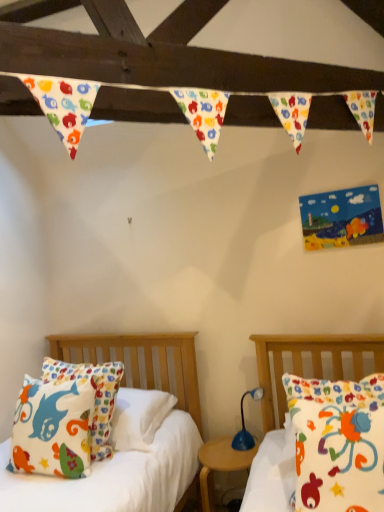
Question: Is matte cotton pillow at left, placed as the 2th bed when sorted from front to back, positioned before blue plastic lamp at center?

Choices:
 (A) yes
 (B) no

Answer: (A)

Question: Is matte cotton pillow at left, which ranks as the 1th bed in left-to-right order, outside of blue plastic lamp at center?

Choices:
 (A) no
 (B) yes

Answer: (B)

Question: From a real-world perspective, is matte cotton pillow at left, acting as the first bed starting from the back, positioned under blue plastic lamp at center based on gravity?

Choices:
 (A) no
 (B) yes

Answer: (A)

Question: Is matte cotton pillow at left, acting as the first bed starting from the back, behind blue plastic lamp at center?

Choices:
 (A) yes
 (B) no

Answer: (B)

Question: Is matte cotton pillow at left, which ranks as the 2th bed in right-to-left order, shorter than blue plastic lamp at center?

Choices:
 (A) yes
 (B) no

Answer: (B)

Question: Considering the relative positions of matte cotton pillow at left, which ranks as the 1th bed in left-to-right order, and matte cotton pillow at right, the first bed in the front-to-back sequence, in the image provided, is matte cotton pillow at left, which ranks as the 1th bed in left-to-right order, to the left or to the right of matte cotton pillow at right, the first bed in the front-to-back sequence,?

Choices:
 (A) left
 (B) right

Answer: (A)

Question: From their relative heights in the image, would you say matte cotton pillow at left, placed as the 2th bed when sorted from front to back, is taller or shorter than matte cotton pillow at right, positioned as the 2th bed in back-to-front order?

Choices:
 (A) tall
 (B) short

Answer: (B)

Question: Based on their sizes in the image, would you say matte cotton pillow at left, which ranks as the 1th bed in left-to-right order, is bigger or smaller than matte cotton pillow at right, arranged as the 2th bed when viewed from the left?

Choices:
 (A) big
 (B) small

Answer: (B)

Question: Do you think matte cotton pillow at left, acting as the first bed starting from the back, is within matte cotton pillow at right, placed as the 1th bed when sorted from right to left, or outside of it?

Choices:
 (A) outside
 (B) inside

Answer: (A)

Question: Does point (61, 432) appear closer or farther from the camera than point (355, 338)?

Choices:
 (A) farther
 (B) closer

Answer: (B)

Question: Considering the positions of matte cotton pillow at left and matte cotton pillow at right, the first bed in the front-to-back sequence, in the image, is matte cotton pillow at left bigger or smaller than matte cotton pillow at right, the first bed in the front-to-back sequence,?

Choices:
 (A) small
 (B) big

Answer: (A)

Question: Would you say matte cotton pillow at left is to the left or to the right of matte cotton pillow at right, the first bed in the front-to-back sequence, in the picture?

Choices:
 (A) right
 (B) left

Answer: (B)

Question: From the image's perspective, is matte cotton pillow at left positioned above or below matte cotton pillow at right, placed as the 1th bed when sorted from right to left?

Choices:
 (A) above
 (B) below

Answer: (B)

Question: Is matte cotton pillow at right, placed as the 1th bed when sorted from right to left, wider or thinner than wooden nightstand at center?

Choices:
 (A) wide
 (B) thin

Answer: (B)

Question: Visually, is matte cotton pillow at right, placed as the 1th bed when sorted from right to left, positioned to the left or to the right of wooden nightstand at center?

Choices:
 (A) right
 (B) left

Answer: (A)